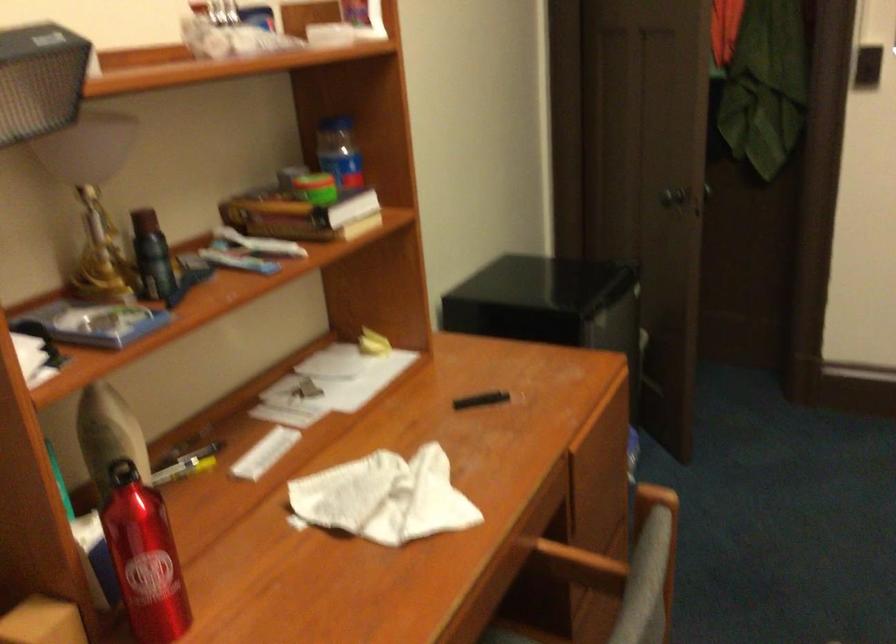
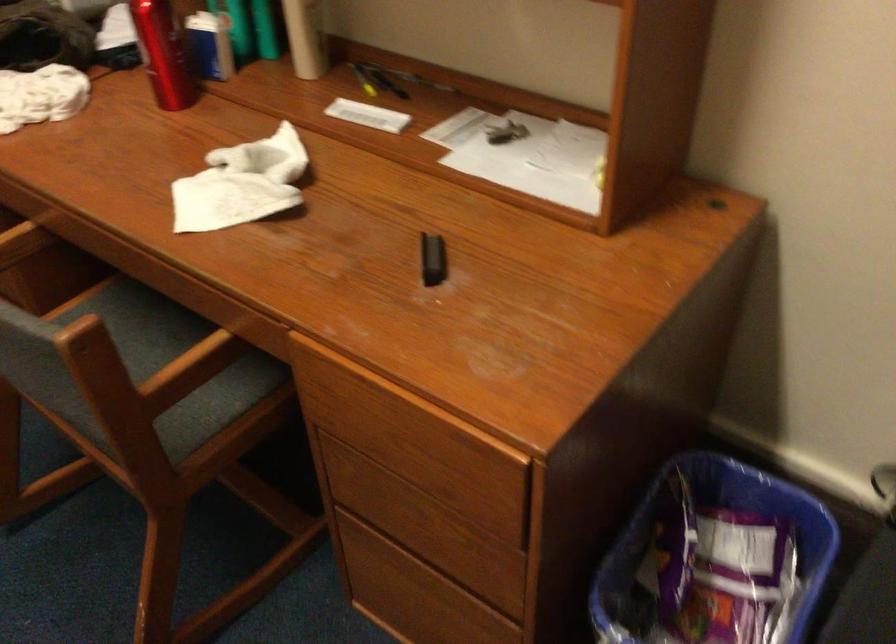
Locate, in the second image, the point that corresponds to (x=170, y=467) in the first image.

(376, 80)